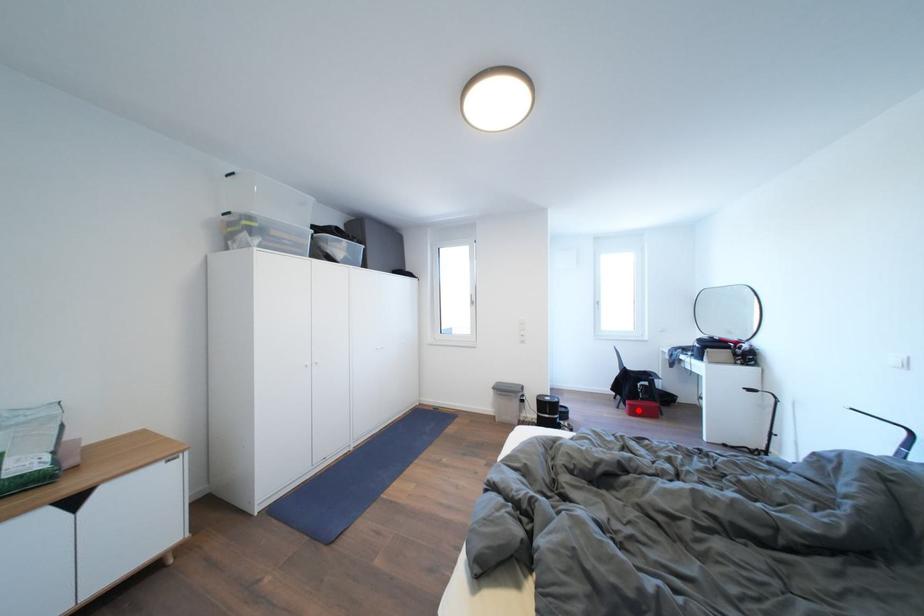
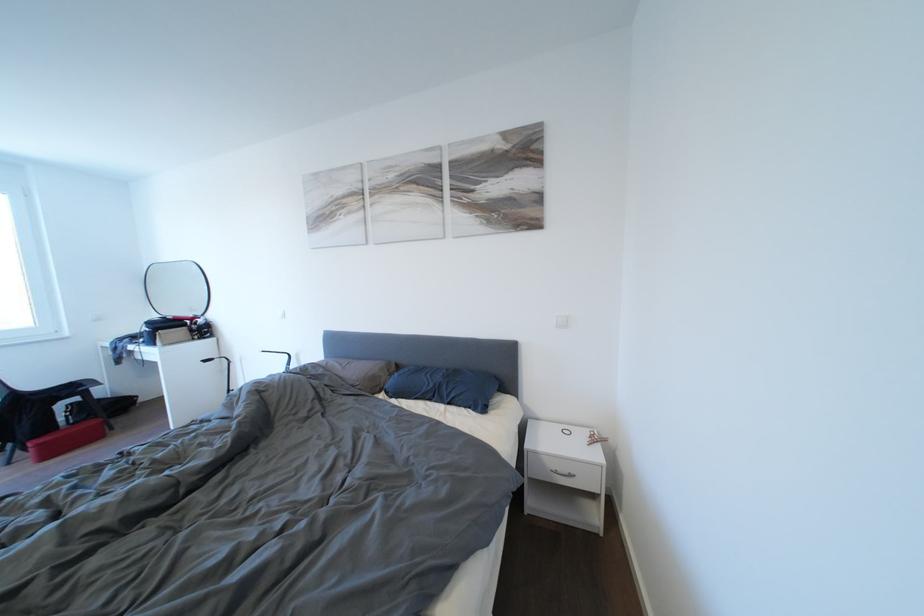
Question: I am providing you with two images of the same scene from different viewpoints. Image1 has a red point marked. In image2, the corresponding 3D location appears at what relative position? Reply with the corresponding letter.

Choices:
 (A) Closer
 (B) Farther

Answer: (A)